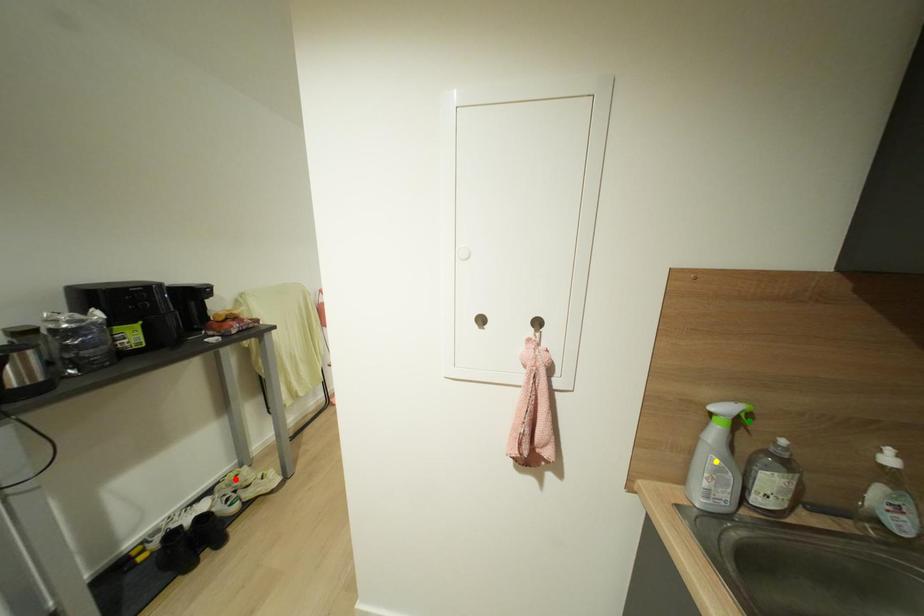
Order these from farthest to nearest:
A) yellow point
B) red point
C) green point

red point < yellow point < green point